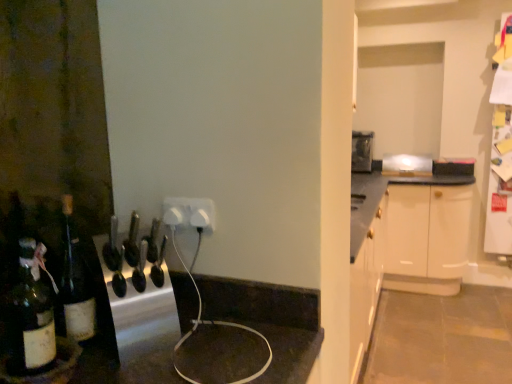
Question: Choose the correct answer: Is white plastic outlet at center inside metallic silver knife block at center, which ranks as the first appliance in bottom-to-top order, or outside it?

Choices:
 (A) outside
 (B) inside

Answer: (A)

Question: In the image, is white plastic outlet at center positioned in front of or behind metallic silver knife block at center, the first appliance in the left-to-right sequence?

Choices:
 (A) front
 (B) behind

Answer: (B)

Question: Which object is positioned closest to the white plastic outlet at center?

Choices:
 (A) metallic silver toaster at upper center, which is the 2th appliance from left to right
 (B) metallic silver knife block at center, the 2th appliance in the top-to-bottom sequence
 (C) translucent glass bottle at left
 (D) dark brown glass bottle at lower left

Answer: (B)

Question: Which object is positioned farthest from the white plastic outlet at center?

Choices:
 (A) metallic silver knife block at center, which is the second appliance from back to front
 (B) dark brown glass bottle at lower left
 (C) metallic silver toaster at upper center, the first appliance positioned from the back
 (D) translucent glass bottle at left

Answer: (C)